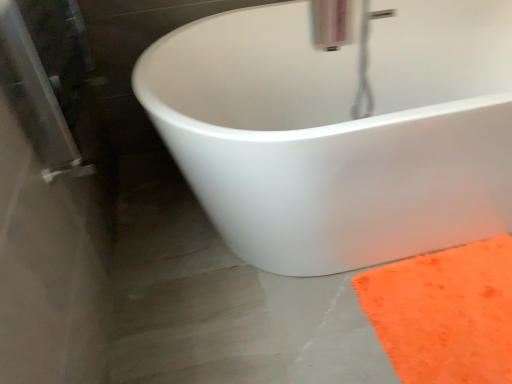
Question: Is white matte bathtub at center facing away from orange fuzzy rug at lower right?

Choices:
 (A) yes
 (B) no

Answer: (B)

Question: Can you confirm if white matte bathtub at center is positioned to the left of orange fuzzy rug at lower right?

Choices:
 (A) yes
 (B) no

Answer: (A)

Question: Can you confirm if white matte bathtub at center is taller than orange fuzzy rug at lower right?

Choices:
 (A) yes
 (B) no

Answer: (A)

Question: Is white matte bathtub at center shorter than orange fuzzy rug at lower right?

Choices:
 (A) no
 (B) yes

Answer: (A)

Question: Does white matte bathtub at center have a larger size compared to orange fuzzy rug at lower right?

Choices:
 (A) no
 (B) yes

Answer: (B)

Question: From a real-world perspective, is orange fuzzy rug at lower right above or below metallic silver faucet at upper center?

Choices:
 (A) below
 (B) above

Answer: (A)

Question: Is orange fuzzy rug at lower right to the left or to the right of metallic silver faucet at upper center in the image?

Choices:
 (A) right
 (B) left

Answer: (A)

Question: Do you think orange fuzzy rug at lower right is within metallic silver faucet at upper center, or outside of it?

Choices:
 (A) inside
 (B) outside

Answer: (B)

Question: Is point (508, 286) closer or farther from the camera than point (365, 21)?

Choices:
 (A) closer
 (B) farther

Answer: (A)

Question: Visually, is metallic silver faucet at upper center positioned to the left or to the right of orange fuzzy rug at lower right?

Choices:
 (A) right
 (B) left

Answer: (B)

Question: Is metallic silver faucet at upper center inside the boundaries of orange fuzzy rug at lower right, or outside?

Choices:
 (A) outside
 (B) inside

Answer: (A)

Question: From the image's perspective, relative to orange fuzzy rug at lower right, is metallic silver faucet at upper center above or below?

Choices:
 (A) below
 (B) above

Answer: (B)

Question: In terms of size, does metallic silver faucet at upper center appear bigger or smaller than orange fuzzy rug at lower right?

Choices:
 (A) big
 (B) small

Answer: (A)

Question: Visually, is metallic silver faucet at upper center positioned to the left or to the right of white matte bathtub at center?

Choices:
 (A) left
 (B) right

Answer: (A)

Question: Is point (310, 6) positioned closer to the camera than point (468, 4)?

Choices:
 (A) farther
 (B) closer

Answer: (B)